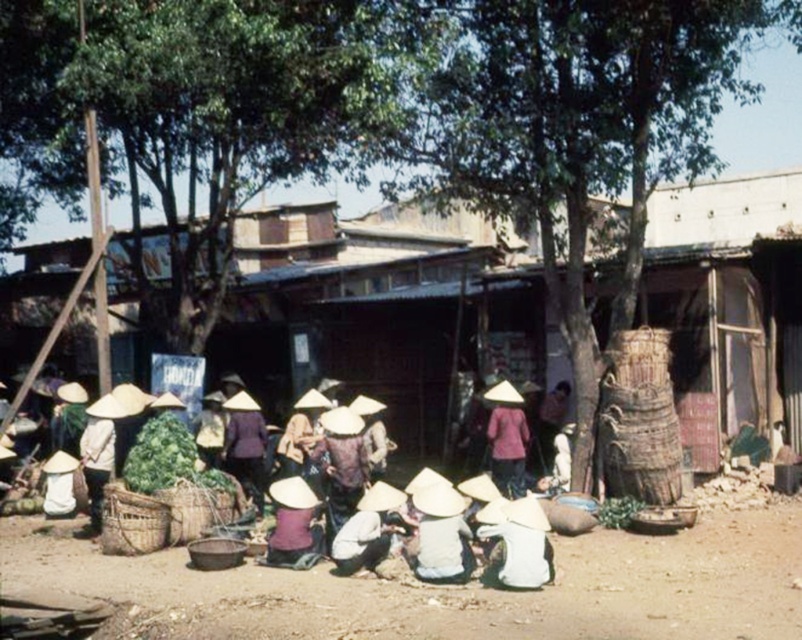
Question: Is matte white conical hat at center below white straw hat at lower center?

Choices:
 (A) no
 (B) yes

Answer: (A)

Question: In this image, where is brown dirt field at lower center located relative to matte white conical hat at center?

Choices:
 (A) above
 (B) below

Answer: (B)

Question: Which point is farther to the camera?

Choices:
 (A) matte white hat at center
 (B) white straw hat at lower center

Answer: (A)

Question: Which of the following is the closest to the observer?

Choices:
 (A) (335, 561)
 (B) (515, 456)

Answer: (A)

Question: Can you confirm if white straw hat at lower center is bigger than purple fabric hat at center?

Choices:
 (A) yes
 (B) no

Answer: (A)

Question: Among these points, which one is nearest to the camera?

Choices:
 (A) (379, 522)
 (B) (192, 532)
 (C) (517, 461)

Answer: (A)